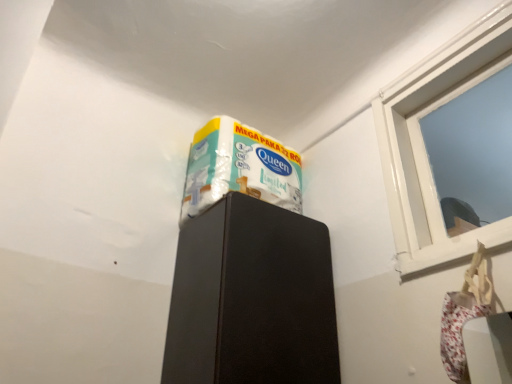
The image size is (512, 384). Identify the location of empty space that is ontop of white glossy window at upper right (from a real-world perspective). (443, 56).